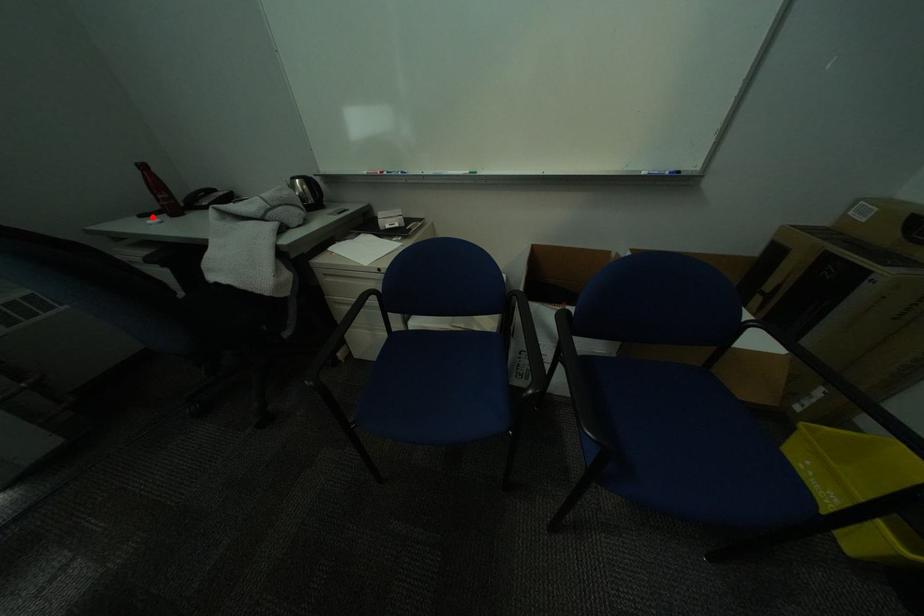
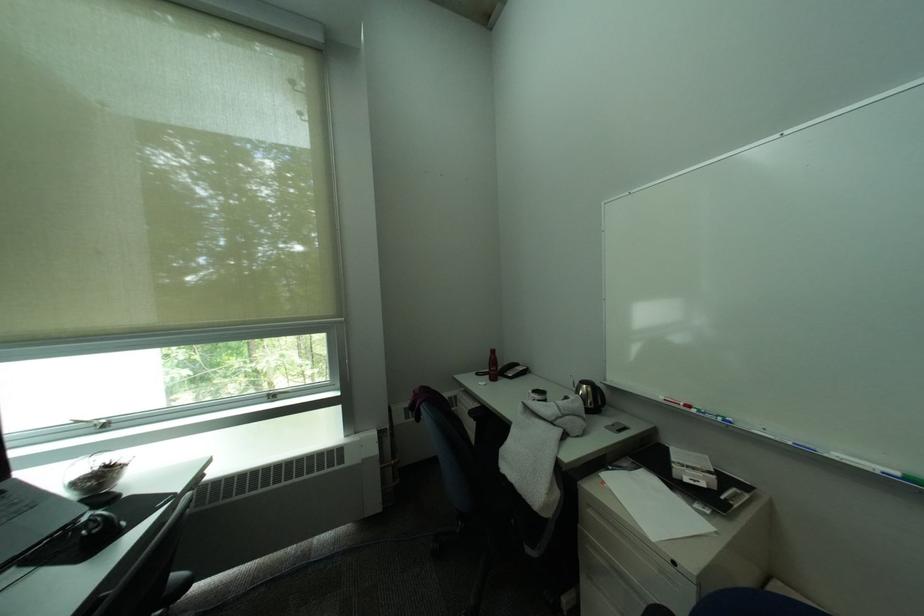
Question: I am providing you with two images of the same scene from different viewpoints. In image1, a red point is highlighted. Considering the same 3D point in image2, which of the following is correct?

Choices:
 (A) It is closer
 (B) It is farther

Answer: (B)